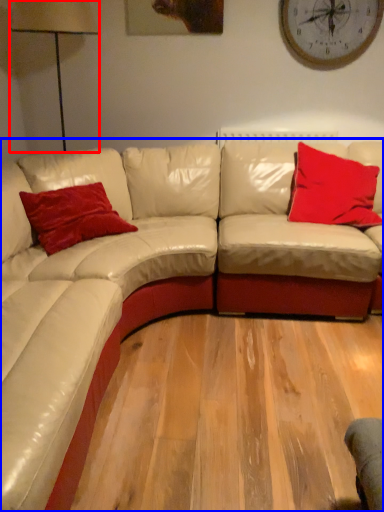
Question: Among these objects, which one is farthest to the camera, table lamp (highlighted by a red box) or studio couch (highlighted by a blue box)?

Choices:
 (A) table lamp
 (B) studio couch

Answer: (A)